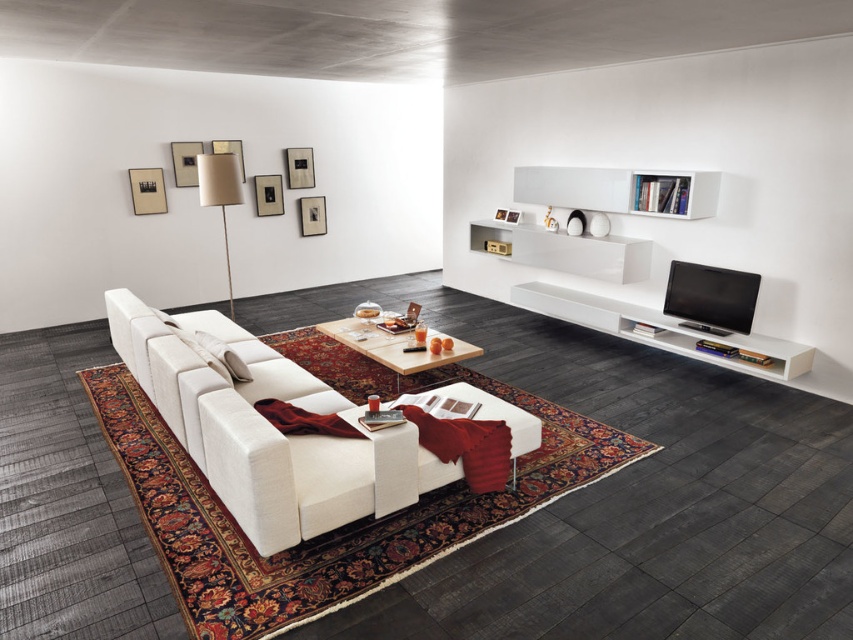
You are standing in the living room and want to pick up an item from the coffee table. You notice two points marked on the table surface. Which point is closer to you, point (622, 211) or point (202, 342)?

Point (202, 342) is closer to you because it is less further to the camera than point (622, 211).

You are standing in the living room and want to grab a book from the coffee table. The white fabric couch at center is between you and the coffee table. Can you reach the coffee table without moving the couch?

The white fabric couch at center is 2.36 meters away from viewer, so yes, you can reach the coffee table without moving the couch since you are already 2.36 meters away from the couch and it is between you and the table.

In the scene shown: You are a delivery person who just arrived at the house. You need to place a large package that is 3 meters long in the living room. The package must be placed between the white glossy bookshelf at upper center and the white fabric pillow at center. Is there enough space between them to fit the package?

The distance between the white glossy bookshelf at upper center and the white fabric pillow at center is 3.68 meters. Since the package is 3 meters long, there is sufficient space to place it between them.